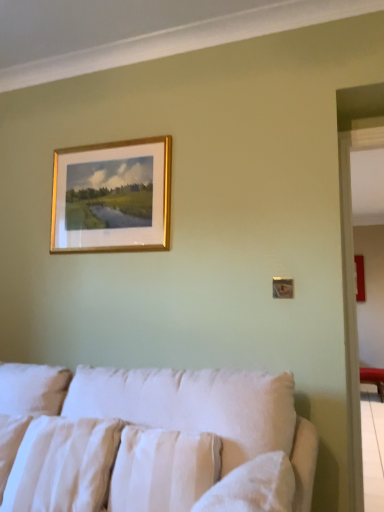
Question: Is white cotton pillow at lower left, which is the 2th pillow in right-to-left order, to the left or to the right of white fabric couch at lower center in the image?

Choices:
 (A) right
 (B) left

Answer: (B)

Question: In terms of size, does white cotton pillow at lower left, acting as the 1th pillow starting from the left, appear bigger or smaller than white fabric couch at lower center?

Choices:
 (A) small
 (B) big

Answer: (A)

Question: Which is nearer to the white fabric couch at lower center?

Choices:
 (A) white textured pillow at lower center, the 2th pillow in the left-to-right sequence
 (B) gold-framed painting at upper center
 (C) white cotton pillow at lower left, acting as the 1th pillow starting from the left

Answer: (A)

Question: Which object is the farthest from the white cotton pillow at lower left, acting as the 1th pillow starting from the left?

Choices:
 (A) white textured pillow at lower center, the 2th pillow in the left-to-right sequence
 (B) white fabric couch at lower center
 (C) gold-framed painting at upper center

Answer: (C)